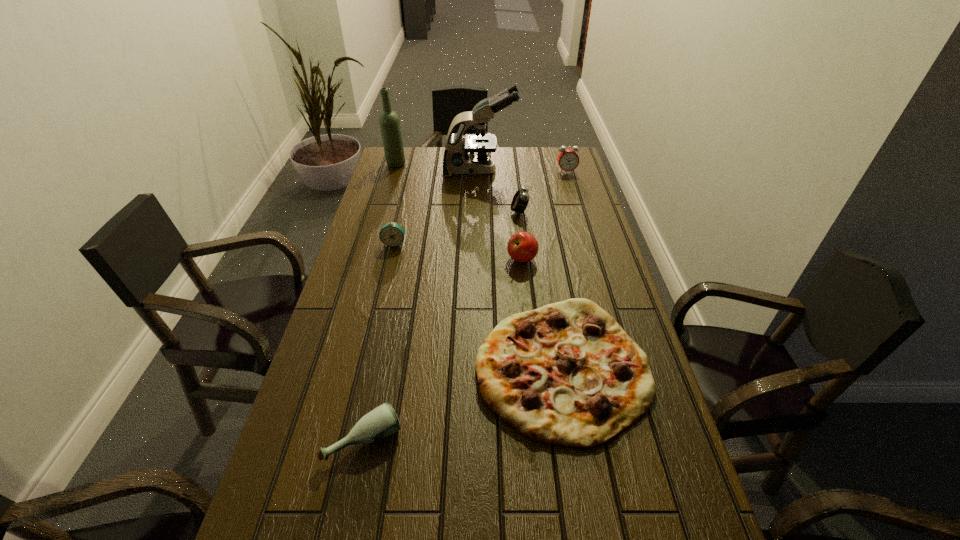
Locate an element on the screen. The height and width of the screenshot is (540, 960). vacant area between the microscope and the shortest object is located at coordinates (521, 269).

Identify the location of vacant space that is in between the farthest alarm clock and the second alarm clock from left to right. (543, 192).

Image resolution: width=960 pixels, height=540 pixels. I want to click on free spot between the wine bottle and the bottle, so click(380, 301).

At what (x,y) coordinates should I click in order to perform the action: click on free spot between the microscope and the nearest alarm clock. Please return your answer as a coordinate pair (x, y). Looking at the image, I should click on (437, 207).

Locate which object ranks fourth in proximity to the leftmost alarm clock. Please provide its 2D coordinates. Your answer should be formatted as a tuple, i.e. [(x, y)], where the tuple contains the x and y coordinates of a point satisfying the conditions above.

[(456, 160)]

Find the location of a particular element. This screenshot has height=540, width=960. object that ranks as the seventh closest to the farthest alarm clock is located at coordinates (381, 422).

I want to click on alarm clock that is the third closest one to the microscope, so click(392, 234).

Choose which alarm clock is the second nearest neighbor to the leftmost alarm clock. Please provide its 2D coordinates. Your answer should be formatted as a tuple, i.e. [(x, y)], where the tuple contains the x and y coordinates of a point satisfying the conditions above.

[(568, 160)]

You are a GUI agent. You are given a task and a screenshot of the screen. Output one action in this format:
    pyautogui.click(x=<x>, y=<y>)
    Task: Click on the blank space that satisfies the following two spatial constraints: 1. on the front-facing side of the bottle; 2. on the right side of the shortest alarm clock
    
    Given the screenshot: What is the action you would take?
    pyautogui.click(x=348, y=439)

Locate an element on the screen. free space that satisfies the following two spatial constraints: 1. on the back side of the third nearest object; 2. on the right side of the bottle is located at coordinates (401, 259).